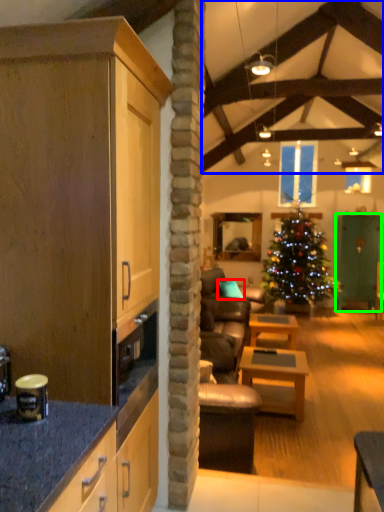
Question: Which object is positioned farthest from pillow (highlighted by a red box)? Select from exhaust hood (highlighted by a blue box) and glass door (highlighted by a green box).

Choices:
 (A) exhaust hood
 (B) glass door

Answer: (A)